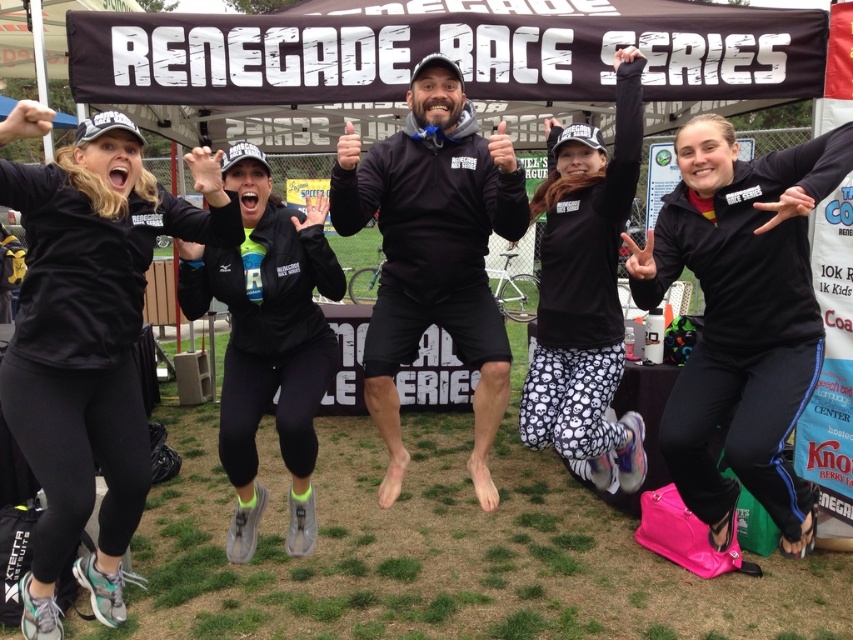
You are a photographer positioned at the starting line of the Renegade Race Series. You want to capture a photo that includes both the point at coordinates point (386, 156) and point (309, 410). Which point is closer to your camera lens?

Point (309, 410) is closer to the camera lens because it is less further away than point (386, 156), which is positioned further away from the camera.